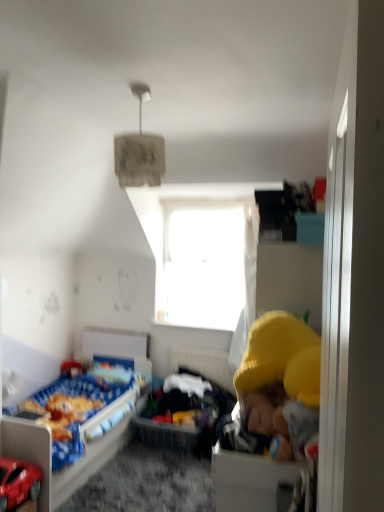
Describe the element at coordinates (250, 481) in the screenshot. I see `white plastic drawer at lower right` at that location.

Measure the distance between point (190, 289) and camera.

3.91 meters.

This screenshot has width=384, height=512. I want to click on white plastic drawer at lower right, so click(250, 481).

Measure the distance between white plastic drawer at lower right and blue fabric bed at lower left.

white plastic drawer at lower right and blue fabric bed at lower left are 1.70 meters apart from each other.

Looking at this image, is white plastic drawer at lower right positioned behind blue fabric bed at lower left?

No.

Looking at this image, considering the sizes of white plastic drawer at lower right and blue fabric bed at lower left in the image, is white plastic drawer at lower right wider or thinner than blue fabric bed at lower left?

white plastic drawer at lower right is thinner than blue fabric bed at lower left.

Are white plastic drawer at lower right and blue fabric bed at lower left located far from each other?

Indeed, white plastic drawer at lower right is not near blue fabric bed at lower left.

Measure the distance between transparent glass window at center and shiny red car at lower left.

transparent glass window at center is 6.67 feet away from shiny red car at lower left.

From a real-world perspective, is transparent glass window at center over shiny red car at lower left?

Yes, from a real-world perspective, transparent glass window at center is above shiny red car at lower left.

From the image's perspective, which is below, transparent glass window at center or shiny red car at lower left?

shiny red car at lower left.

At what (x,y) coordinates should I click in order to perform the action: click on window lying above the shiny red car at lower left (from the image's perspective). Please return your answer as a coordinate pair (x, y). The width and height of the screenshot is (384, 512). Looking at the image, I should click on (207, 262).

Is shiny red car at lower left oriented away from textured paper lampshade at upper center?

No, shiny red car at lower left is not facing the opposite direction of textured paper lampshade at upper center.

From the image's perspective, is shiny red car at lower left above or below textured paper lampshade at upper center?

From the image's perspective, shiny red car at lower left appears below textured paper lampshade at upper center.

Considering the sizes of shiny red car at lower left and textured paper lampshade at upper center in the image, is shiny red car at lower left bigger or smaller than textured paper lampshade at upper center?

In the image, shiny red car at lower left appears to be larger than textured paper lampshade at upper center.

Which of these two, shiny red car at lower left or textured paper lampshade at upper center, is thinner?

Thinner between the two is textured paper lampshade at upper center.

From the picture: From a real-world perspective, is blue fabric bed at lower left under transparent glass window at center?

Yes.

From the picture: Is blue fabric bed at lower left smaller than transparent glass window at center?

Incorrect, blue fabric bed at lower left is not smaller in size than transparent glass window at center.

Considering the sizes of objects blue fabric bed at lower left and transparent glass window at center in the image provided, who is wider, blue fabric bed at lower left or transparent glass window at center?

blue fabric bed at lower left.

At what (x,y) coordinates should I click in order to perform the action: click on window on the right of blue fabric bed at lower left. Please return your answer as a coordinate pair (x, y). This screenshot has height=512, width=384. Looking at the image, I should click on (207, 262).

Where is `toy behind the white plastic drawer at lower right`? toy behind the white plastic drawer at lower right is located at coordinates click(18, 483).

Are shiny red car at lower left and white plastic drawer at lower right located far from each other?

Indeed, shiny red car at lower left is not near white plastic drawer at lower right.

What's the angular difference between shiny red car at lower left and white plastic drawer at lower right's facing directions?

The angular difference between shiny red car at lower left and white plastic drawer at lower right is 87.2 degrees.

From a real-world perspective, which is physically below, shiny red car at lower left or white plastic drawer at lower right?

In real-world perspective, shiny red car at lower left is lower.

Is point (253, 252) farther from viewer compared to point (117, 408)?

Yes, point (253, 252) is behind point (117, 408).

Is transparent glass window at center oriented towards blue fabric bed at lower left?

No, transparent glass window at center is not oriented towards blue fabric bed at lower left.

Consider the image. From a real-world perspective, between transparent glass window at center and blue fabric bed at lower left, who is vertically higher?

transparent glass window at center is physically above.

You are a GUI agent. You are given a task and a screenshot of the screen. Output one action in this format:
    pyautogui.click(x=<x>, y=<y>)
    Task: Click on the infant bed behind the white plastic drawer at lower right
    Image resolution: width=384 pixels, height=512 pixels.
    Given the screenshot: What is the action you would take?
    pyautogui.click(x=184, y=414)

Consider the image. Can you confirm if soft fabric basket at center is positioned to the right of white plastic drawer at lower right?

No, soft fabric basket at center is not to the right of white plastic drawer at lower right.

Could you tell me if soft fabric basket at center is turned towards white plastic drawer at lower right?

Yes, soft fabric basket at center is facing white plastic drawer at lower right.

Which object is more forward, soft fabric basket at center or white plastic drawer at lower right?

white plastic drawer at lower right.

The width and height of the screenshot is (384, 512). Find the location of `bed below the white plastic drawer at lower right (from the image's perspective)`. bed below the white plastic drawer at lower right (from the image's perspective) is located at coordinates (80, 418).

The height and width of the screenshot is (512, 384). Find the location of `window on the right of shiny red car at lower left`. window on the right of shiny red car at lower left is located at coordinates (207, 262).

Considering their positions, is transparent glass window at center positioned closer to white plastic drawer at lower right than shiny red car at lower left?

The object closer to white plastic drawer at lower right is shiny red car at lower left.

Consider the image. Estimate the real-world distances between objects in this image. Which object is closer to soft fabric basket at center, transparent glass window at center or blue fabric bed at lower left?

The object closer to soft fabric basket at center is blue fabric bed at lower left.

Looking at the image, which one is located further to blue fabric bed at lower left, transparent glass window at center or textured paper lampshade at upper center?

The object further to blue fabric bed at lower left is textured paper lampshade at upper center.

When comparing their distances from textured paper lampshade at upper center, does transparent glass window at center or blue fabric bed at lower left seem further?

Among the two, blue fabric bed at lower left is located further to textured paper lampshade at upper center.

From the image, which object appears to be farther from textured paper lampshade at upper center, white plastic drawer at lower right or shiny red car at lower left?

Based on the image, shiny red car at lower left appears to be further to textured paper lampshade at upper center.

Which object lies nearer to the anchor point white plastic drawer at lower right, transparent glass window at center or blue fabric bed at lower left?

blue fabric bed at lower left.

Estimate the real-world distances between objects in this image. Which object is closer to white plastic drawer at lower right, transparent glass window at center or soft fabric basket at center?

Among the two, soft fabric basket at center is located nearer to white plastic drawer at lower right.

In the scene shown: Which object lies nearer to the anchor point blue fabric bed at lower left, shiny red car at lower left or soft fabric basket at center?

soft fabric basket at center is positioned closer to the anchor blue fabric bed at lower left.

I want to click on infant bed that lies between textured paper lampshade at upper center and blue fabric bed at lower left from top to bottom, so click(x=184, y=414).

Find the location of a particular element. This screenshot has height=512, width=384. toy between white plastic drawer at lower right and blue fabric bed at lower left in the front-back direction is located at coordinates (18, 483).

Identify the location of toy between white plastic drawer at lower right and soft fabric basket at center from front to back. (18, 483).

Locate an element on the screen. infant bed between shiny red car at lower left and transparent glass window at center in the front-back direction is located at coordinates (184, 414).